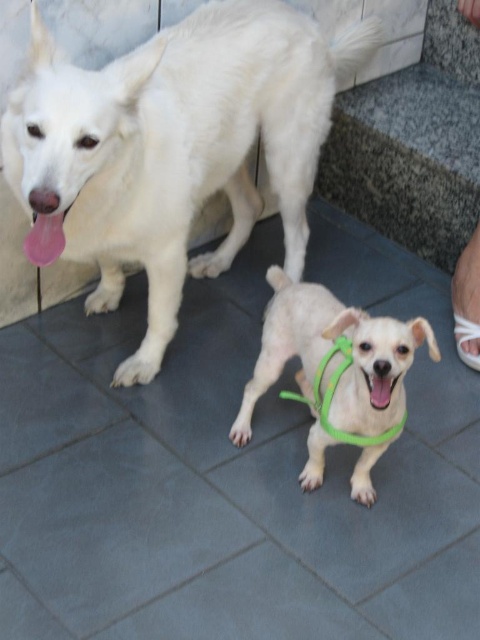
You are a photographer trying to capture both the white fur dog at upper left and the black matte mouth at center in a single shot. Given that your camera has a fixed focal length, which object should you position closer to the camera to ensure both fit in the frame?

Since the white fur dog at upper left is larger in width than the black matte mouth at center, positioning the white fur dog at upper left closer to the camera will help balance their sizes in the frame, ensuring both fit within the shot.

Consider the image. You are a photographer trying to capture a closeup of the black matte mouth at center while keeping the white fur dog at upper left in the frame. Given that your camera has a maximum focus range of 36 inches, will you be able to achieve this shot?

The white fur dog at upper left is 35.96 inches from the black matte mouth at center. Since the distance is just under the camera maximum focus range of 36 inches, the photographer can achieve the closeup shot while keeping the white fur dog at upper left in the frame.

In the scene shown: Where is the white fur dog at upper left located in the image?

The white fur dog at upper left is located at point (172, 147).